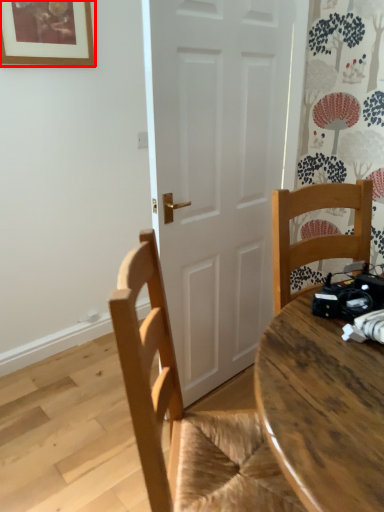
Question: Observing the image, what is the correct spatial positioning of picture frame (annotated by the red box) in reference to chair?

Choices:
 (A) right
 (B) left

Answer: (B)